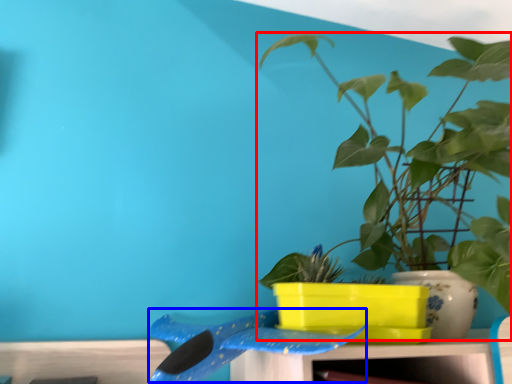
Question: Which of the following is the farthest to the observer, houseplant (highlighted by a red box) or whale (highlighted by a blue box)?

Choices:
 (A) houseplant
 (B) whale

Answer: (B)